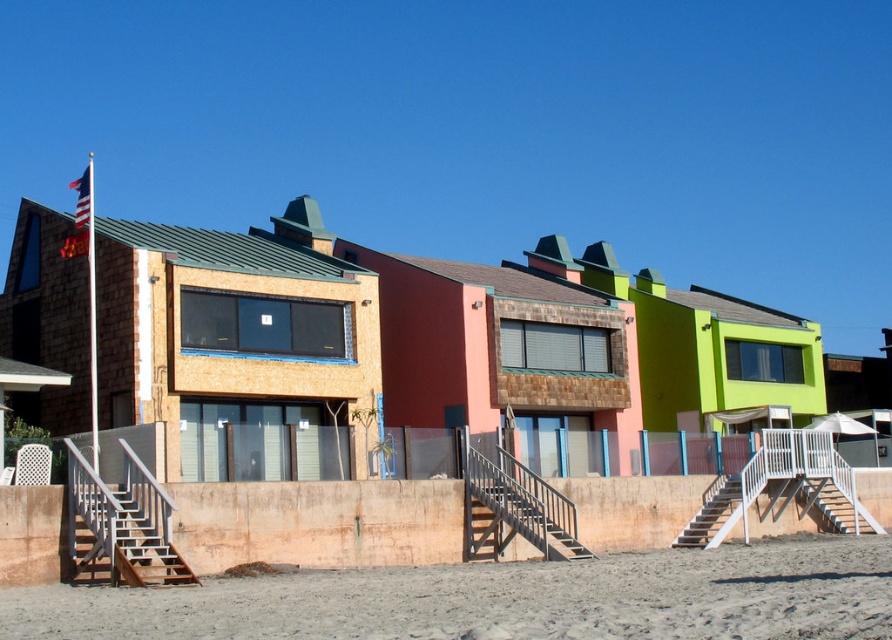
Question: Is white wooden stairs at lower right behind american flag at upper left?

Choices:
 (A) no
 (B) yes

Answer: (B)

Question: Among these points, which one is nearest to the camera?

Choices:
 (A) 500,541
 (B) 838,513

Answer: (A)

Question: Which of the following is the closest to the observer?

Choices:
 (A) brown sandy beach at lower center
 (B) white metal stairs at lower right
 (C) wooden stairs at center

Answer: (A)

Question: Is the position of wooden stairs at center more distant than that of white wooden stairs at lower right?

Choices:
 (A) no
 (B) yes

Answer: (A)

Question: Is wooden stairs at center bigger than white metal stairs at lower right?

Choices:
 (A) no
 (B) yes

Answer: (B)

Question: Based on their relative distances, which object is nearer to the white wooden stairs at lower right?

Choices:
 (A) brown sandy beach at lower center
 (B) american flag at upper left

Answer: (A)